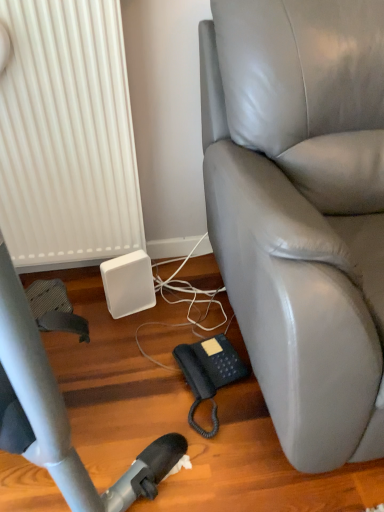
This screenshot has height=512, width=384. What do you see at coordinates (301, 211) in the screenshot?
I see `gray leather chair at right` at bounding box center [301, 211].

You are a GUI agent. You are given a task and a screenshot of the screen. Output one action in this format:
    pyautogui.click(x=<x>, y=<y>)
    Task: Click on the gray leather chair at right
    Image resolution: width=384 pixels, height=512 pixels.
    Given the screenshot: What is the action you would take?
    pyautogui.click(x=301, y=211)

Which is more to the left, gray leather chair at right or white matte speaker at lower left?

Positioned to the left is white matte speaker at lower left.

How far apart are gray leather chair at right and white matte speaker at lower left?

gray leather chair at right is 25.24 inches from white matte speaker at lower left.

Would you say gray leather chair at right is a long distance from white matte speaker at lower left?

No, gray leather chair at right is in close proximity to white matte speaker at lower left.

What are the coordinates of `speaker that appears below the gray leather chair at right (from a real-world perspective)` in the screenshot? It's located at (128, 284).

Consider the image. From the image's perspective, which one is positioned lower, white ribbed radiator at lower left or black rubberized phone at lower center?

black rubberized phone at lower center.

Identify the location of radiator on the left of the black rubberized phone at lower center. Image resolution: width=384 pixels, height=512 pixels. (67, 136).

Does white ribbed radiator at lower left have a greater height compared to black rubberized phone at lower center?

Yes, white ribbed radiator at lower left is taller than black rubberized phone at lower center.

Is gray leather chair at right facing away from black rubberized phone at lower center?

That's not correct — gray leather chair at right is not looking away from black rubberized phone at lower center.

Is gray leather chair at right far away from black rubberized phone at lower center?

They are positioned close to each other.

Consider the image. From the image's perspective, which object appears higher, gray leather chair at right or black rubberized phone at lower center?

gray leather chair at right appears higher in the image.

Is black rubberized phone at lower center touching white ribbed radiator at lower left?

They are not placed beside each other.

Between point (206, 369) and point (15, 239), which one is positioned in front?

The point (206, 369) is in front.

Is black rubberized phone at lower center surrounding white ribbed radiator at lower left?

No, white ribbed radiator at lower left is not surrounded by black rubberized phone at lower center.

From the image's perspective, between black rubberized phone at lower center and white ribbed radiator at lower left, which one is located above?

From the image's view, white ribbed radiator at lower left is above.

Measure the distance from white ribbed radiator at lower left to white matte speaker at lower left.

They are 31.96 centimeters apart.

Does white ribbed radiator at lower left have a greater height compared to white matte speaker at lower left?

Yes, white ribbed radiator at lower left is taller than white matte speaker at lower left.

From the image's perspective, would you say white ribbed radiator at lower left is positioned over white matte speaker at lower left?

Indeed, from the image's perspective, white ribbed radiator at lower left is shown above white matte speaker at lower left.

Which is more to the left, white ribbed radiator at lower left or white matte speaker at lower left?

From the viewer's perspective, white ribbed radiator at lower left appears more on the left side.

Does white matte speaker at lower left have a larger size compared to white ribbed radiator at lower left?

Actually, white matte speaker at lower left might be smaller than white ribbed radiator at lower left.

Can you confirm if white matte speaker at lower left is wider than white ribbed radiator at lower left?

In fact, white matte speaker at lower left might be narrower than white ribbed radiator at lower left.

Is white matte speaker at lower left not close to white ribbed radiator at lower left?

Actually, white matte speaker at lower left and white ribbed radiator at lower left are a little close together.

From the image's perspective, which is below, white matte speaker at lower left or white ribbed radiator at lower left?

white matte speaker at lower left appears lower in the image.

At what (x,y) coordinates should I click in order to perform the action: click on chair located below the white ribbed radiator at lower left (from the image's perspective). Please return your answer as a coordinate pair (x, y). The height and width of the screenshot is (512, 384). Looking at the image, I should click on (301, 211).

Does point (106, 52) lie behind point (317, 317)?

Yes, point (106, 52) is farther from viewer.

Are white ribbed radiator at lower left and gray leather chair at right beside each other?

No, white ribbed radiator at lower left is not making contact with gray leather chair at right.

In the scene shown: From the image's perspective, which is below, white ribbed radiator at lower left or gray leather chair at right?

gray leather chair at right appears lower in the image.

This screenshot has height=512, width=384. I want to click on chair positioned vertically above the white matte speaker at lower left (from a real-world perspective), so click(301, 211).

Locate an element on the screen. The height and width of the screenshot is (512, 384). radiator above the black rubberized phone at lower center (from the image's perspective) is located at coordinates (67, 136).

From the image, which object appears to be nearer to white matte speaker at lower left, gray leather chair at right or white ribbed radiator at lower left?

The object closer to white matte speaker at lower left is white ribbed radiator at lower left.

Based on their spatial positions, is white matte speaker at lower left or gray leather chair at right further from black rubberized phone at lower center?

gray leather chair at right.

Based on their spatial positions, is white matte speaker at lower left or white ribbed radiator at lower left further from gray leather chair at right?

Based on the image, white matte speaker at lower left appears to be further to gray leather chair at right.

Looking at the image, which one is located further to white ribbed radiator at lower left, gray leather chair at right or black rubberized phone at lower center?

black rubberized phone at lower center is further to white ribbed radiator at lower left.

When comparing their distances from black rubberized phone at lower center, does white ribbed radiator at lower left or gray leather chair at right seem further?

Among the two, white ribbed radiator at lower left is located further to black rubberized phone at lower center.

Looking at the image, which one is located closer to white matte speaker at lower left, black rubberized phone at lower center or gray leather chair at right?

Based on the image, black rubberized phone at lower center appears to be nearer to white matte speaker at lower left.

When comparing their distances from black rubberized phone at lower center, does gray leather chair at right or white matte speaker at lower left seem closer?

white matte speaker at lower left.

Looking at the image, which one is located closer to white matte speaker at lower left, black rubberized phone at lower center or white ribbed radiator at lower left?

white ribbed radiator at lower left is positioned closer to the anchor white matte speaker at lower left.

You are a GUI agent. You are given a task and a screenshot of the screen. Output one action in this format:
    pyautogui.click(x=<x>, y=<y>)
    Task: Click on the radiator between gray leather chair at right and white matte speaker at lower left along the z-axis
    This screenshot has width=384, height=512.
    Given the screenshot: What is the action you would take?
    pyautogui.click(x=67, y=136)

Identify the location of speaker between white ribbed radiator at lower left and black rubberized phone at lower center in the up-down direction. The image size is (384, 512). (128, 284).

Find the location of a particular element. The width and height of the screenshot is (384, 512). corded phone between gray leather chair at right and white matte speaker at lower left in the front-back direction is located at coordinates (209, 373).

Locate an element on the screen. corded phone between white ribbed radiator at lower left and gray leather chair at right in the horizontal direction is located at coordinates (209, 373).